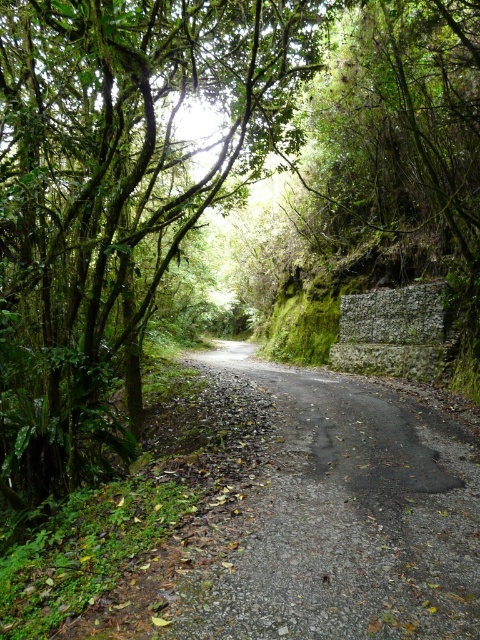
Can you confirm if green leafy tree at center is smaller than dark gray asphalt road at center?

No.

Does green leafy tree at center appear on the right side of dark gray asphalt road at center?

No, green leafy tree at center is not to the right of dark gray asphalt road at center.

Does point (0, 452) lie in front of point (411, 483)?

No, it is behind (411, 483).

You are a GUI agent. You are given a task and a screenshot of the screen. Output one action in this format:
    pyautogui.click(x=<x>, y=<y>)
    Task: Click on the green leafy tree at center
    The height and width of the screenshot is (640, 480).
    Given the screenshot: What is the action you would take?
    pyautogui.click(x=115, y=195)